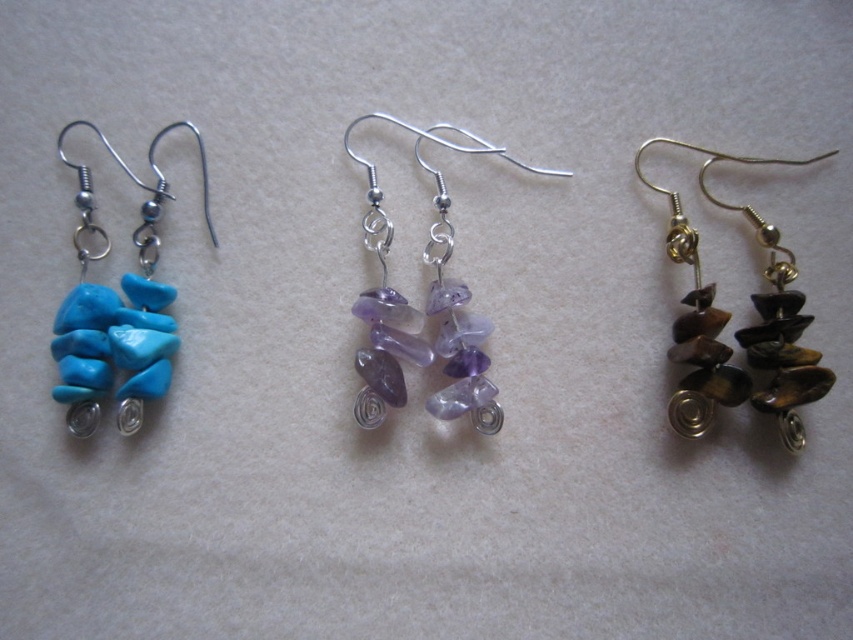
This screenshot has width=853, height=640. What are the coordinates of `turquoise stone earrings at left` in the screenshot? It's located at (119, 307).

Is brown polished stone earrings at right bigger than purple translucent stones at center?

Correct, brown polished stone earrings at right is larger in size than purple translucent stones at center.

Can you confirm if brown polished stone earrings at right is positioned to the right of purple translucent stones at center?

Correct, you'll find brown polished stone earrings at right to the right of purple translucent stones at center.

Locate an element on the screen. Image resolution: width=853 pixels, height=640 pixels. brown polished stone earrings at right is located at coordinates (740, 328).

This screenshot has width=853, height=640. I want to click on brown polished stone earrings at right, so click(x=740, y=328).

Is point (679, 433) less distant than point (132, 404)?

No, (679, 433) is behind (132, 404).

Does brown polished stone earrings at right have a greater height compared to turquoise stone earrings at left?

Correct, brown polished stone earrings at right is much taller as turquoise stone earrings at left.

Is point (709, 336) positioned before point (84, 172)?

No, (709, 336) is further to viewer.

This screenshot has height=640, width=853. Find the location of `brown polished stone earrings at right`. brown polished stone earrings at right is located at coordinates (740, 328).